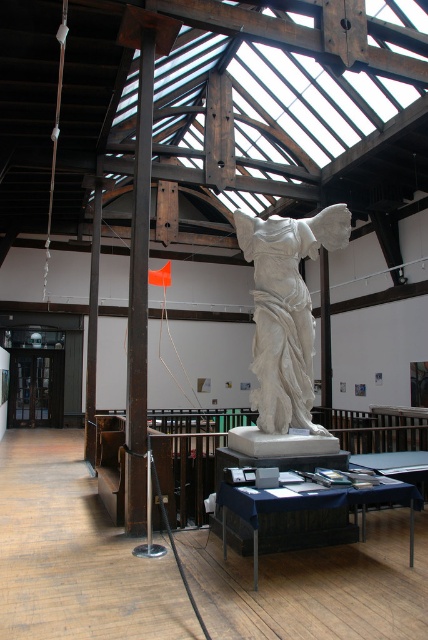
Question: Is white marble statue at center positioned before orange fabric flag at center?

Choices:
 (A) no
 (B) yes

Answer: (B)

Question: Among these objects, which one is nearest to the camera?

Choices:
 (A) orange fabric flag at center
 (B) white marble statue at center

Answer: (B)

Question: Which object is closer to the camera taking this photo?

Choices:
 (A) white marble statue at center
 (B) orange fabric flag at center

Answer: (A)

Question: Does white marble statue at center appear on the left side of orange fabric flag at center?

Choices:
 (A) yes
 (B) no

Answer: (B)

Question: Which object is closer to the camera taking this photo?

Choices:
 (A) orange fabric flag at center
 (B) white marble statue at center

Answer: (B)

Question: Can you confirm if white marble statue at center is positioned to the right of orange fabric flag at center?

Choices:
 (A) yes
 (B) no

Answer: (A)